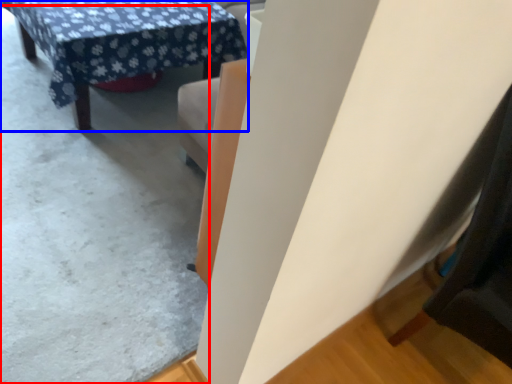
Question: Which point is closer to the camera, concrete (highlighted by a red box) or table (highlighted by a blue box)?

Choices:
 (A) concrete
 (B) table

Answer: (A)